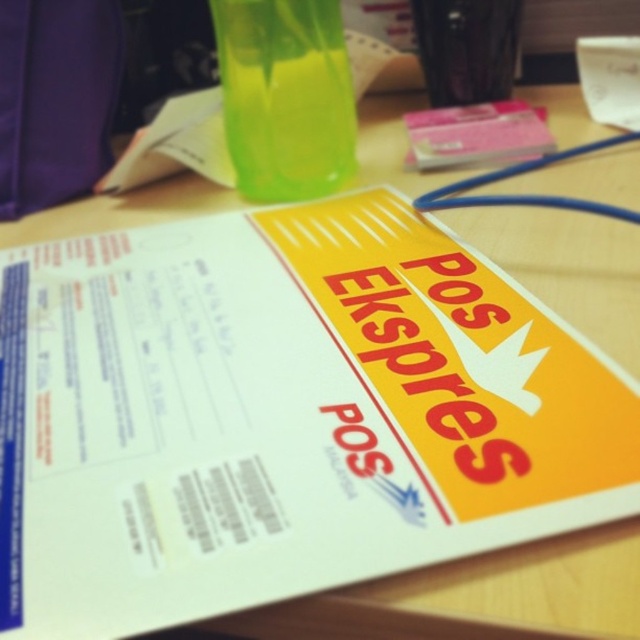
You are organizing items on a desk and need to place a new item between the translucent green cup at upper center and the transparent plastic cup at upper center. Which side should you place it on to ensure it is between them?

You should place the new item to the right of the translucent green cup at upper center and to the left of the transparent plastic cup at upper center since the translucent green cup at upper center is positioned to the left of the transparent plastic cup at upper center.

You are organizing items on a desk and need to place a new item at the point marked by coordinates point (54, 99). What object is currently occupying that location?

The purple fabric bag at upper left is located at point (54, 99).

You are taking a photo of the document with your phone. The document is at point (301,19). Your phone camera has a minimum focus distance of 12 inches. Can you focus on the document without moving your phone closer?

The point (301,19) is 32.29 inches from the camera, which is greater than the minimum focus distance of 12 inches. Therefore, you can focus on the document without moving the phone closer.